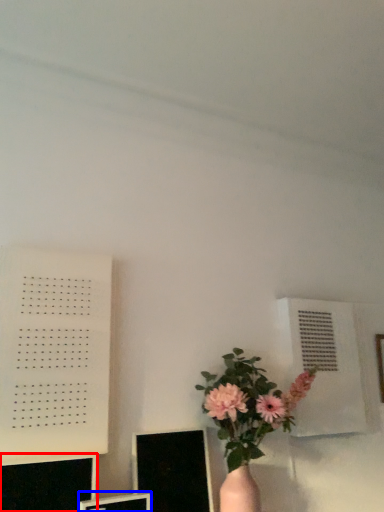
Question: Which of the following is the farthest to the observer, computer monitor (highlighted by a red box) or computer monitor (highlighted by a blue box)?

Choices:
 (A) computer monitor
 (B) computer monitor

Answer: (B)